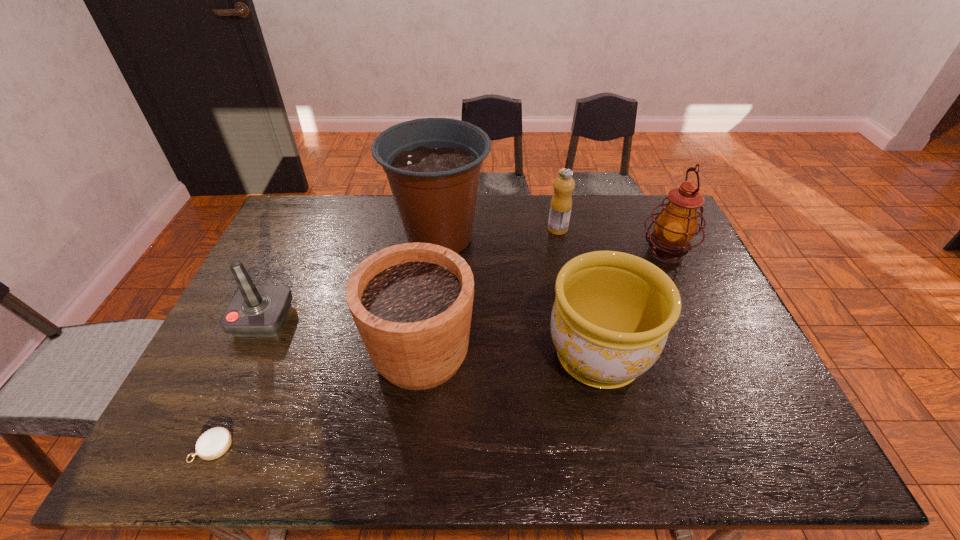
The height and width of the screenshot is (540, 960). I want to click on the tallest flowerpot, so click(x=433, y=165).

What are the coordinates of `the rightmost object` in the screenshot? It's located at 676,225.

I want to click on the rightmost flowerpot, so click(613, 311).

The height and width of the screenshot is (540, 960). Identify the location of fruit juice. (561, 203).

Image resolution: width=960 pixels, height=540 pixels. What are the coordinates of `joystick` in the screenshot? It's located at (255, 310).

Identify the location of the nearest object. The height and width of the screenshot is (540, 960). (212, 444).

The height and width of the screenshot is (540, 960). I want to click on compass, so click(x=212, y=444).

What are the coordinates of `vacant position located on the right of the farthest flowerpot` in the screenshot? It's located at (540, 239).

This screenshot has width=960, height=540. In order to click on vacant point located 0.190m on the left of the oil lamp in this screenshot , I will do `click(579, 253)`.

I want to click on vacant space located 0.360m on the back of the rightmost flowerpot, so click(569, 237).